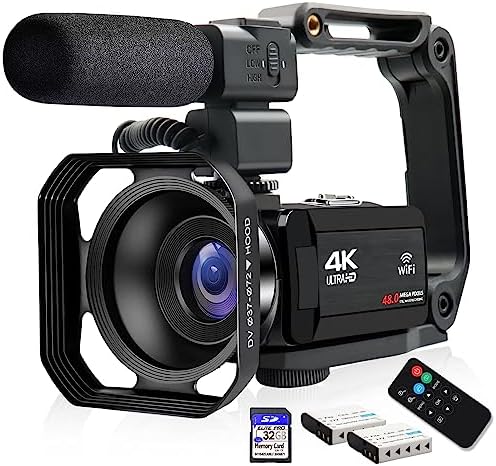
You are a GUI agent. You are given a task and a screenshot of the screen. Output one action in this format:
    pyautogui.click(x=<x>, y=<y>)
    Task: Click on the cord
    This screenshot has width=496, height=466.
    Given the screenshot: What is the action you would take?
    pyautogui.click(x=157, y=133)